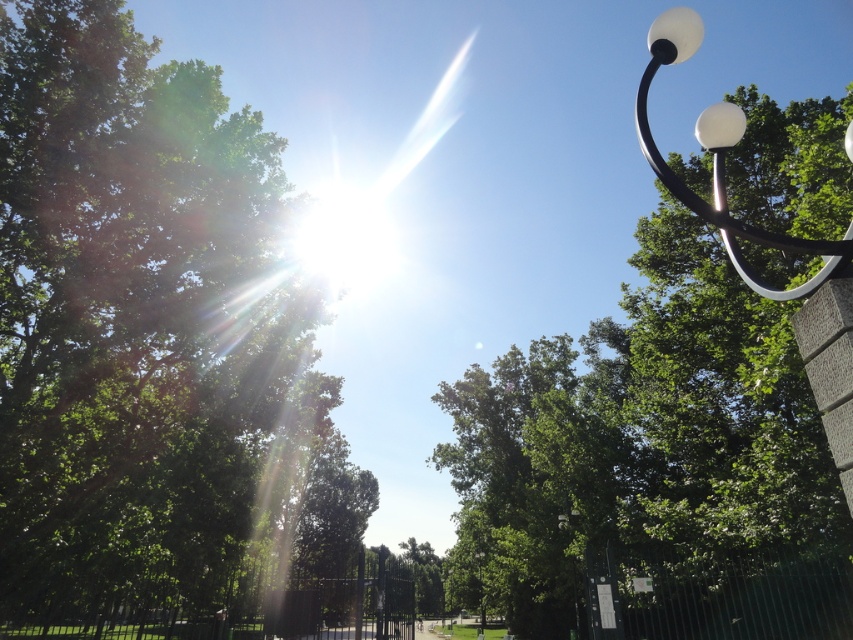
You are a photographer wanting to capture the sun in your shot. You notice the sun is in the upper left. Which object, the green leafy tree at upper center or the white glossy lamp post at upper right, is closer to the sun?

The green leafy tree at upper center is closer to the sun because it is positioned at upper center, which is closer to the sun in the upper left quadrant than the white glossy lamp post at upper right.

You are planning to plant a new tree in the park. The park has two existing trees, the green leafy tree at upper left and the green leafy tree at upper center. Which tree has a wider canopy? Please answer based on the provided scene description.

The green leafy tree at upper left has a wider canopy than the green leafy tree at upper center.

You are a bird flying over the park and want to land on the tallest tree. Which tree should you choose between the green leafy tree at upper left and the green leafy tree at upper center?

The green leafy tree at upper center is taller than the green leafy tree at upper left, so you should choose the green leafy tree at upper center to land on.